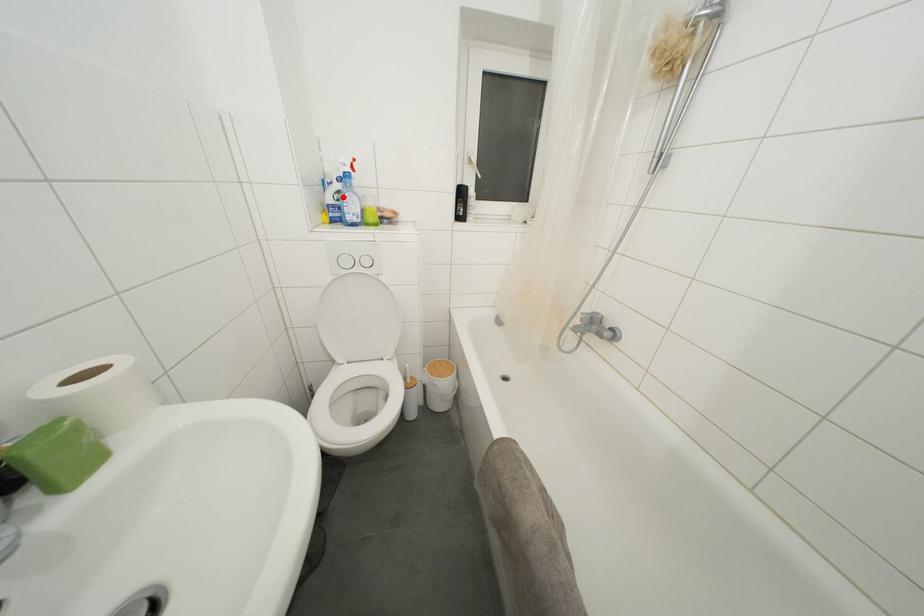
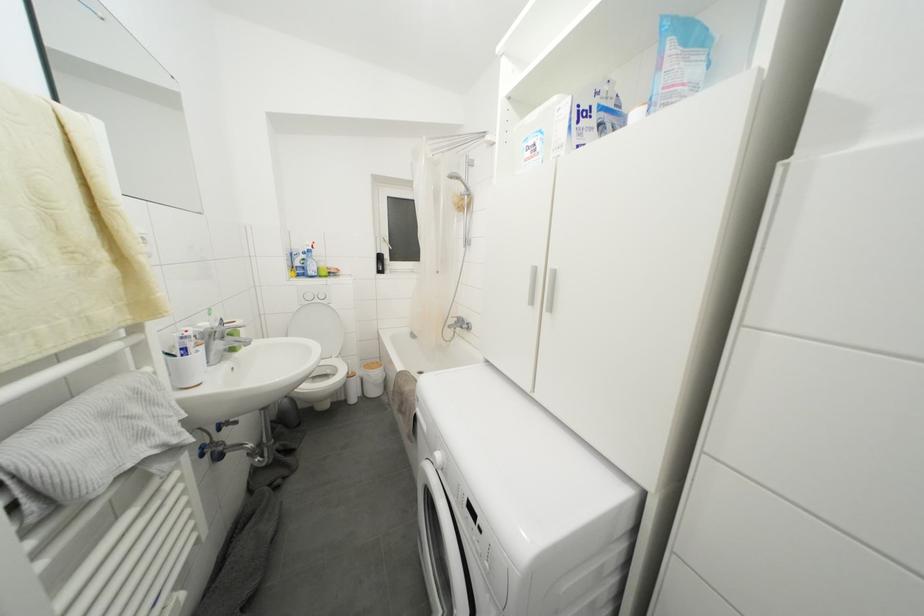
The point at the highlighted location is marked in the first image. Where is the corresponding point in the second image?

(308, 264)